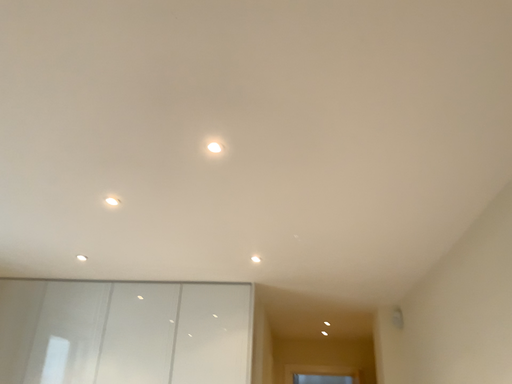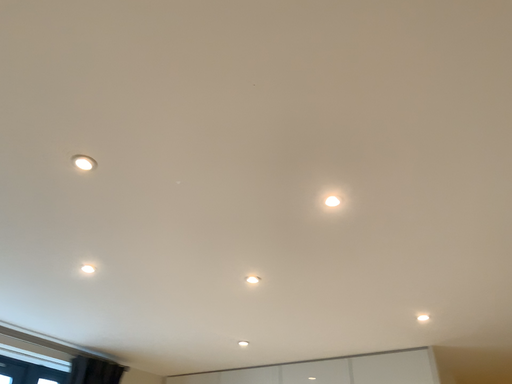
Question: Which way did the camera rotate in the video?

Choices:
 (A) rotated downward
 (B) rotated upward

Answer: (B)